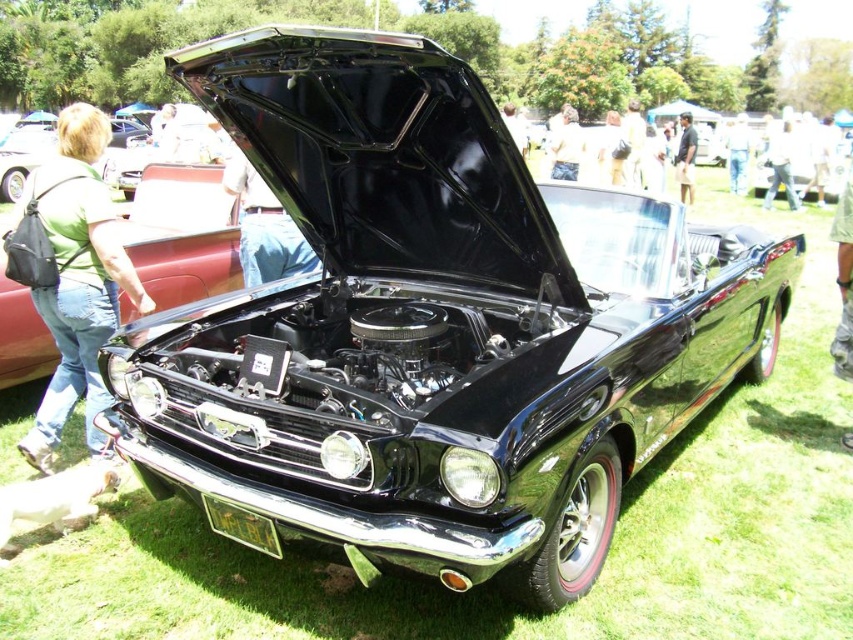
Question: In this image, where is light brown leather jacket at center located relative to denim pants at center?

Choices:
 (A) below
 (B) above

Answer: (B)

Question: Estimate the real-world distances between objects in this image. Which object is farther from the light brown leather jacket at center?

Choices:
 (A) jeans at center
 (B) green fabric backpack at left

Answer: (B)

Question: Where is green fabric backpack at left located in relation to dark blue jeans at lower right in the image?

Choices:
 (A) above
 (B) below

Answer: (B)

Question: Estimate the real-world distances between objects in this image. Which object is farther from the light brown leather jacket at center?

Choices:
 (A) jeans at center
 (B) denim pants at center

Answer: (A)

Question: Is green fabric backpack at left closer to the viewer compared to blue denim jeans at center?

Choices:
 (A) yes
 (B) no

Answer: (A)

Question: Which point appears closest to the camera in this image?

Choices:
 (A) (734, 161)
 (B) (784, 188)
 (C) (680, 140)
 (D) (35, 220)

Answer: (D)